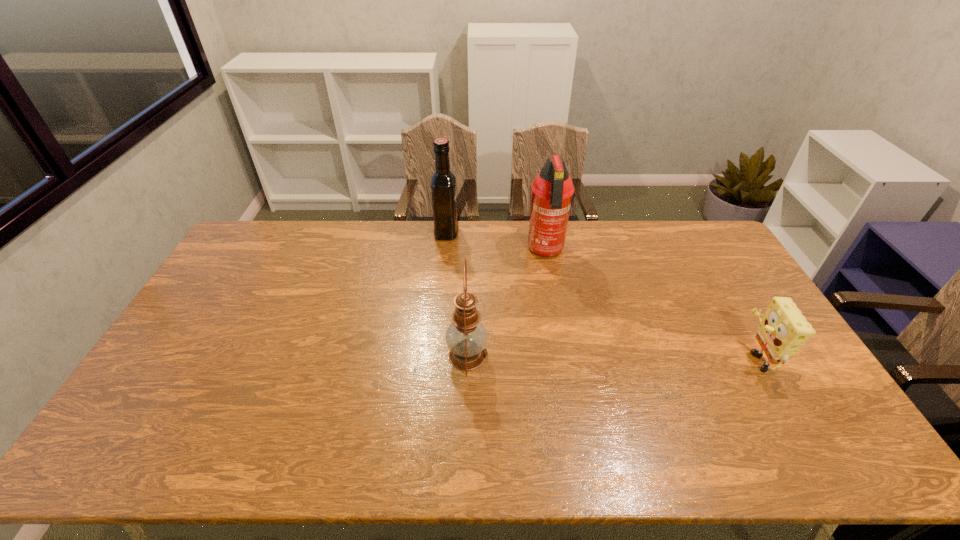
Where is `liquor`? Image resolution: width=960 pixels, height=540 pixels. liquor is located at coordinates (443, 181).

Locate an element on the screen. This screenshot has height=540, width=960. fire extinguisher is located at coordinates (552, 189).

I want to click on oil lamp, so click(466, 337).

Image resolution: width=960 pixels, height=540 pixels. Identify the location of sponge. (783, 330).

Find the location of `the shortest object`. the shortest object is located at coordinates (783, 330).

Find the location of a particular element. This screenshot has height=540, width=960. free space located 0.400m on the front-facing side of the liquor is located at coordinates (563, 232).

You are a GUI agent. You are given a task and a screenshot of the screen. Output one action in this format:
    pyautogui.click(x=<x>, y=<y>)
    Task: Click on the blank space located 0.330m on the trigger side of the fire extinguisher
    
    Given the screenshot: What is the action you would take?
    pyautogui.click(x=562, y=340)

Identify the location of vacant space located 0.060m on the front of the oil lamp. The height and width of the screenshot is (540, 960). (467, 399).

The width and height of the screenshot is (960, 540). Find the location of `free space located on the face of the sponge`. free space located on the face of the sponge is located at coordinates (646, 357).

Find the location of `free space located on the face of the sponge`. free space located on the face of the sponge is located at coordinates (653, 357).